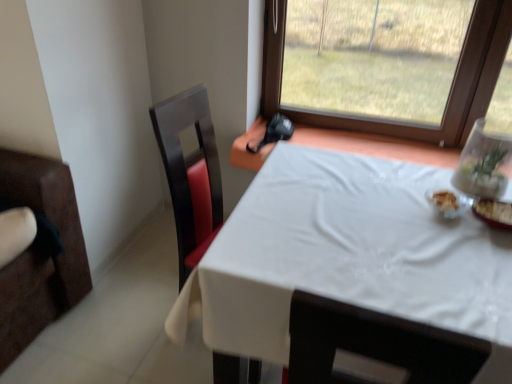
Question: From the image's perspective, relative to matte black swivel chair at left, is transparent glass vase at upper right above or below?

Choices:
 (A) below
 (B) above

Answer: (B)

Question: In terms of size, does transparent glass vase at upper right appear bigger or smaller than matte black swivel chair at left?

Choices:
 (A) small
 (B) big

Answer: (A)

Question: Which of these objects is positioned closest to the white cloth-covered table at center?

Choices:
 (A) white glossy bowl at upper right
 (B) transparent glass vase at upper right
 (C) matte black swivel chair at left

Answer: (A)

Question: Considering the real-world distances, which object is closest to the white cloth-covered table at center?

Choices:
 (A) matte black swivel chair at left
 (B) transparent glass vase at upper right
 (C) white glossy bowl at upper right

Answer: (C)